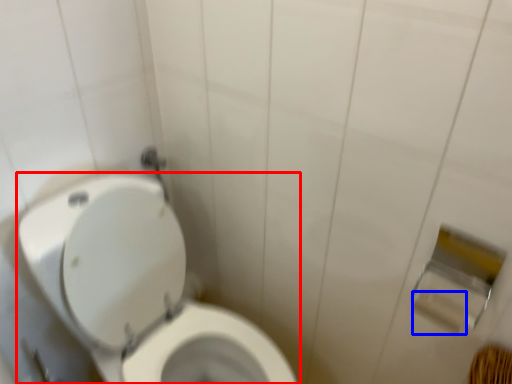
Question: Which point is further to the camera, toilet (highlighted by a red box) or toilet paper (highlighted by a blue box)?

Choices:
 (A) toilet
 (B) toilet paper

Answer: (B)